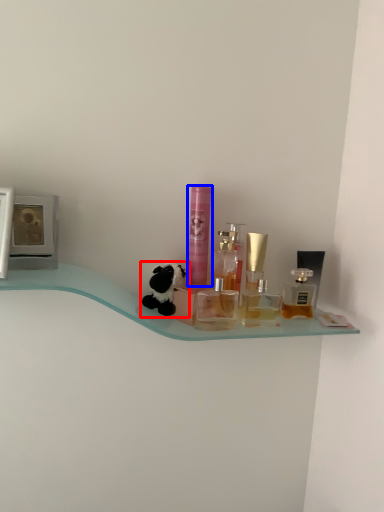
Question: Which point is closer to the camera, toy (highlighted by a red box) or toiletry (highlighted by a blue box)?

Choices:
 (A) toy
 (B) toiletry

Answer: (A)